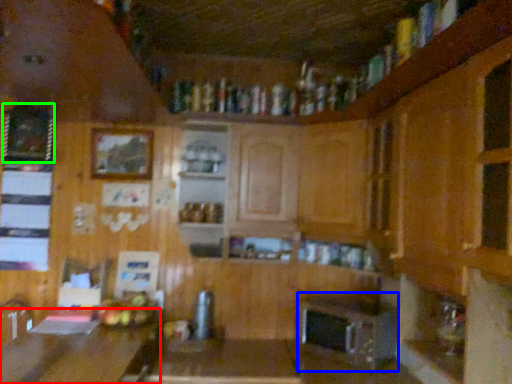
Question: Which object is positioned closest to table (highlighted by a red box)? Select from appliance (highlighted by a blue box) and picture frame (highlighted by a green box).

Choices:
 (A) appliance
 (B) picture frame

Answer: (A)